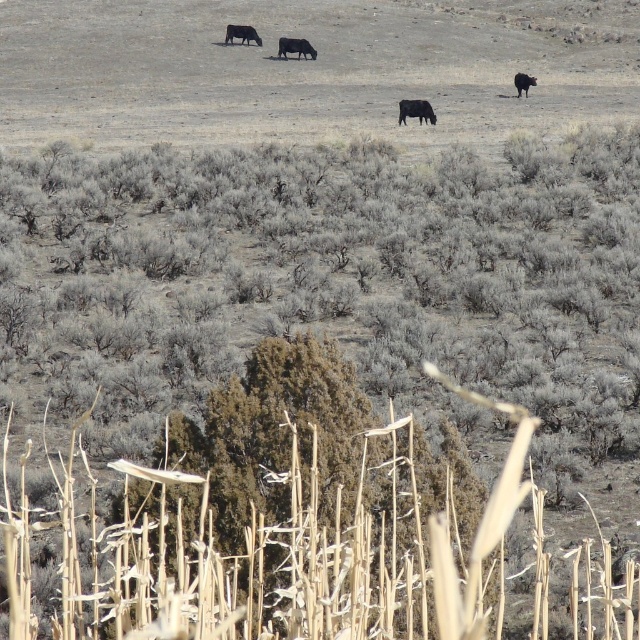
Is point (225, 38) closer to viewer compared to point (516, 88)?

That is False.

Is black matte cow at upper center bigger than black matte cow at upper right?

Yes.

Locate an element on the screen. black matte cow at upper center is located at coordinates pyautogui.click(x=241, y=33).

You are a GUI agent. You are given a task and a screenshot of the screen. Output one action in this format:
    pyautogui.click(x=<x>, y=<y>)
    Task: Click on the black matte cow at upper center
    Image resolution: width=640 pixels, height=640 pixels.
    Given the screenshot: What is the action you would take?
    pyautogui.click(x=241, y=33)

Does point (305, 51) come behind point (248, 29)?

No, it is in front of (248, 29).

Does point (292, 42) lie behind point (244, 26)?

No.

Find the location of `black matte cow at center`. black matte cow at center is located at coordinates (296, 48).

Can you confirm if black matte cow at center is positioned to the right of black matte cow at upper right?

In fact, black matte cow at center is to the left of black matte cow at upper right.

Who is more forward, (280,54) or (524,77)?

Point (524,77)

Where is `black matte cow at center`? The height and width of the screenshot is (640, 640). black matte cow at center is located at coordinates (296, 48).